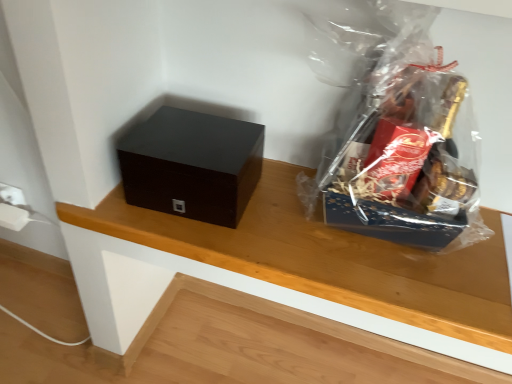
Where is `free spot above matte black box at left (from a real-world perspective)`? This screenshot has width=512, height=384. free spot above matte black box at left (from a real-world perspective) is located at coordinates (199, 139).